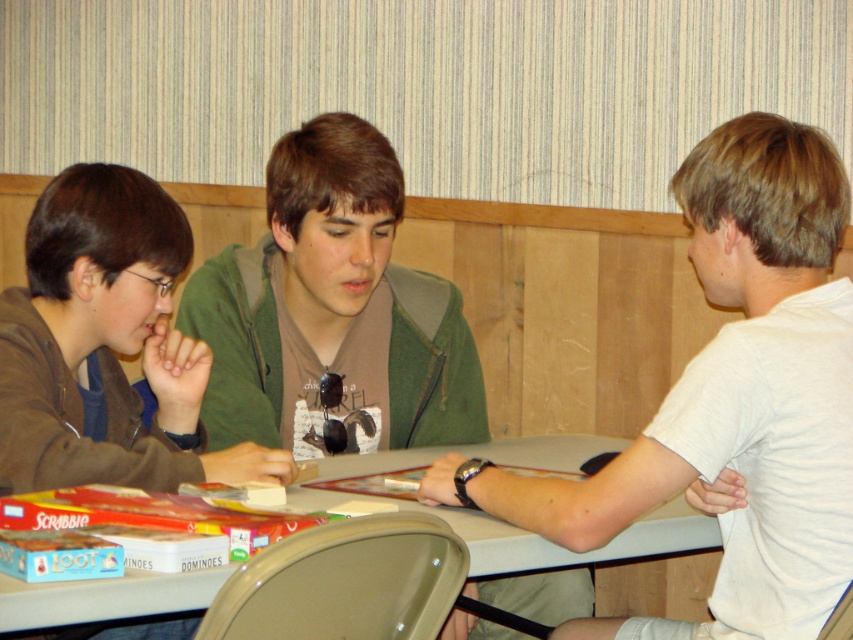
You are a game organizer who needs to place a new game box that is 10 cm thick onto the table. The green matte jacket at center and the smooth plastic table at center are in the way. Which object should you move to make space?

The green matte jacket at center is thinner than the smooth plastic table at center, so the green matte jacket at center should be moved to make space because it is thinner and easier to relocate.

You are a photographer standing behind the table where the white cotton shirt at right and green matte jacket at center are seated. You want to take a photo that includes both subjects without any overlap. Given that your camera has a maximum focus range of 20 inches, will you be able to capture both subjects in a single shot?

The white cotton shirt at right is 21.43 inches from the green matte jacket at center. Since the distance between them exceeds the camera maximum focus range of 20 inches, you will not be able to capture both subjects in a single shot without overlap.